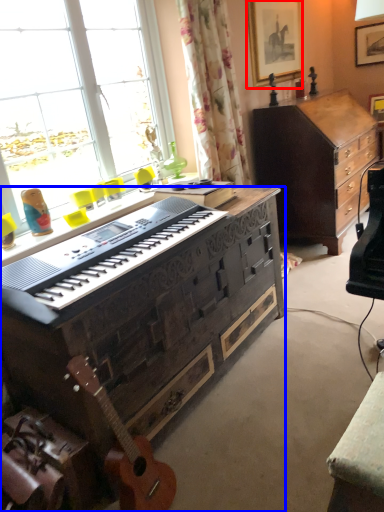
Question: Among these objects, which one is farthest to the camera, picture frame (highlighted by a red box) or desk (highlighted by a blue box)?

Choices:
 (A) picture frame
 (B) desk

Answer: (A)